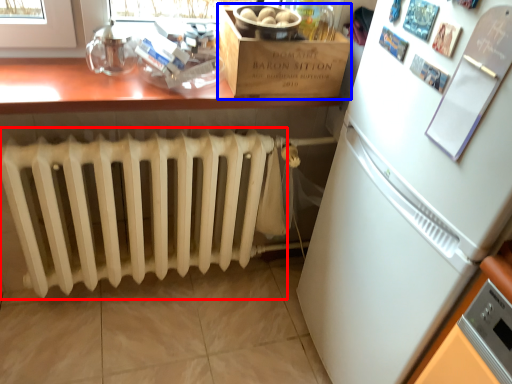
Question: Which object appears closest to the camera in this image, radiator (highlighted by a red box) or cardboard box (highlighted by a blue box)?

Choices:
 (A) radiator
 (B) cardboard box

Answer: (A)